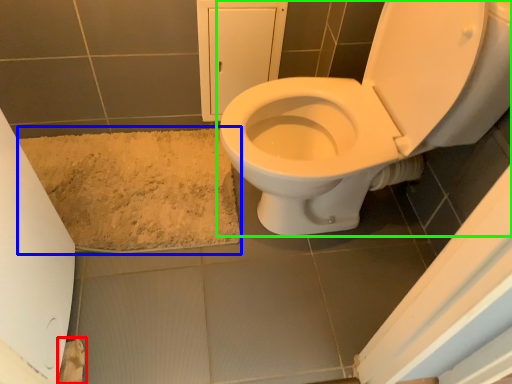
Question: Which object is the closest to the toilet paper (highlighted by a red box)? Choose among these: bath mat (highlighted by a blue box) or toilet (highlighted by a green box).

Choices:
 (A) bath mat
 (B) toilet

Answer: (A)